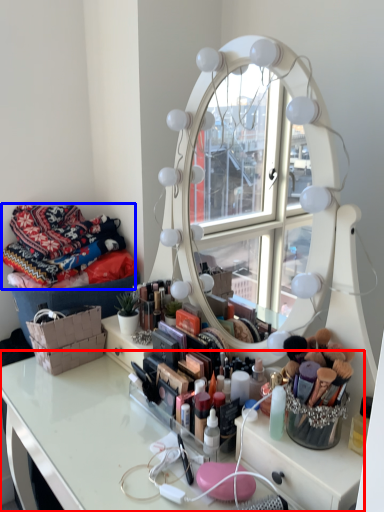
Question: Which object is further to the camera taking this photo, table (highlighted by a red box) or material (highlighted by a blue box)?

Choices:
 (A) table
 (B) material

Answer: (B)